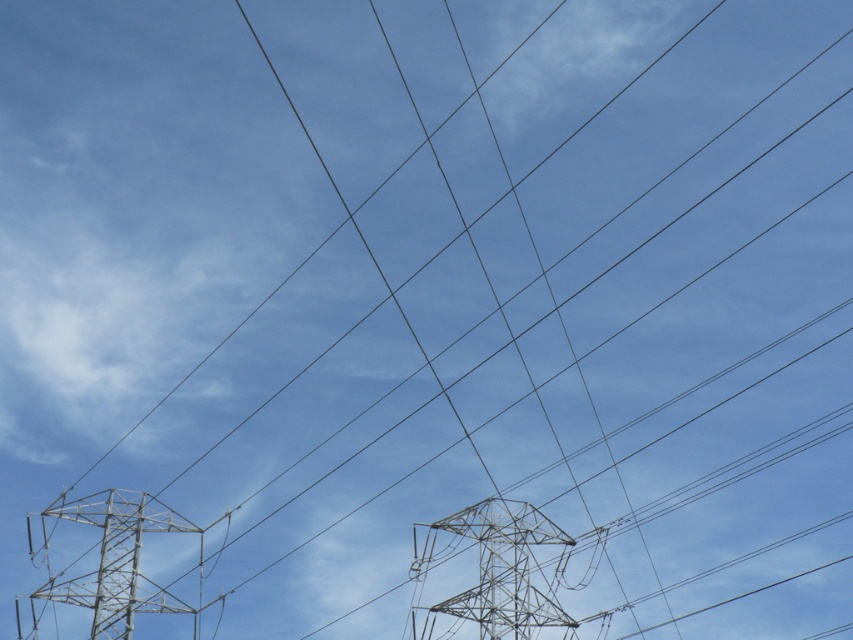
Does metallic silver tower at center appear under metallic silver tower at lower left?

Yes, metallic silver tower at center is below metallic silver tower at lower left.

Identify the location of metallic silver tower at center. (494, 570).